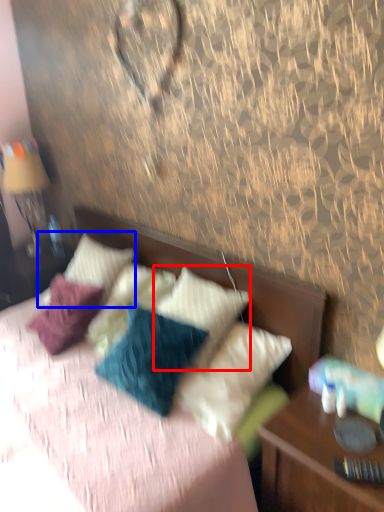
Question: Among these objects, which one is farthest to the camera, pillow (highlighted by a red box) or pillow (highlighted by a blue box)?

Choices:
 (A) pillow
 (B) pillow

Answer: (B)